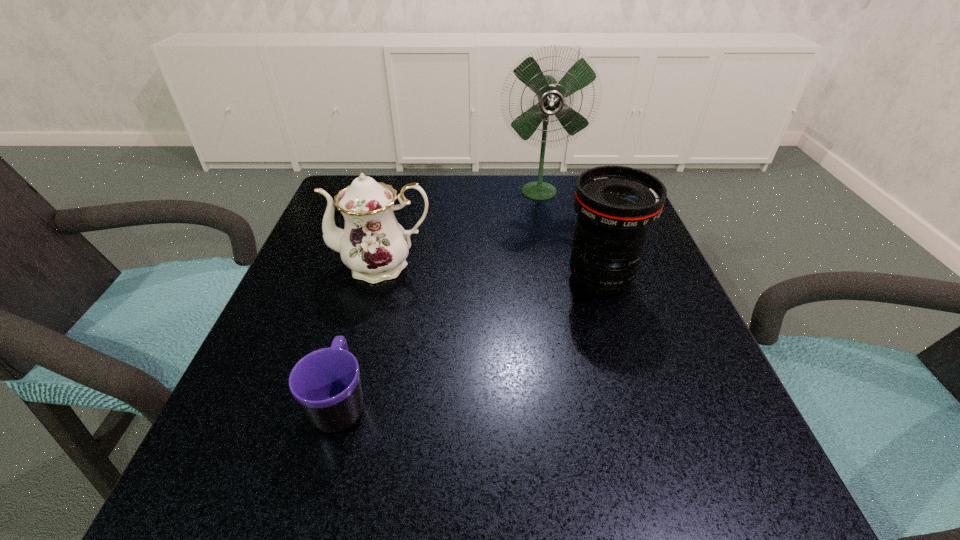
Locate an element on the screen. Image resolution: width=960 pixels, height=540 pixels. free space that is in between the chinaware and the telephoto lens is located at coordinates (492, 272).

Find the location of a particular element. vacant space that is in between the fan and the shortest object is located at coordinates (440, 296).

The image size is (960, 540). What are the coordinates of `the closest object relative to the chinaware` in the screenshot? It's located at (326, 383).

The width and height of the screenshot is (960, 540). What are the coordinates of `object that is the second closest to the chinaware` in the screenshot? It's located at (551, 94).

Locate an element on the screen. vacant space that satisfies the following two spatial constraints: 1. with the handle on the side of the telephoto lens; 2. on the right side of the mug is located at coordinates (375, 279).

I want to click on vacant space that satisfies the following two spatial constraints: 1. with the handle on the side of the chinaware; 2. on the right side of the mug, so click(x=378, y=265).

Locate an element on the screen. free space that satisfies the following two spatial constraints: 1. with the handle on the side of the telephoto lens; 2. on the right side of the mug is located at coordinates (375, 279).

Locate an element on the screen. The image size is (960, 540). free location that satisfies the following two spatial constraints: 1. with the handle on the side of the nearest object; 2. on the right side of the telephoto lens is located at coordinates (375, 279).

What are the coordinates of `free space that satisfies the following two spatial constraints: 1. with the handle on the side of the telephoto lens; 2. on the left side of the nearest object` in the screenshot? It's located at (375, 279).

Where is `vacant space that satisfies the following two spatial constraints: 1. on the front-facing side of the farthest object; 2. on the left side of the telephoto lens`? Image resolution: width=960 pixels, height=540 pixels. vacant space that satisfies the following two spatial constraints: 1. on the front-facing side of the farthest object; 2. on the left side of the telephoto lens is located at coordinates (556, 279).